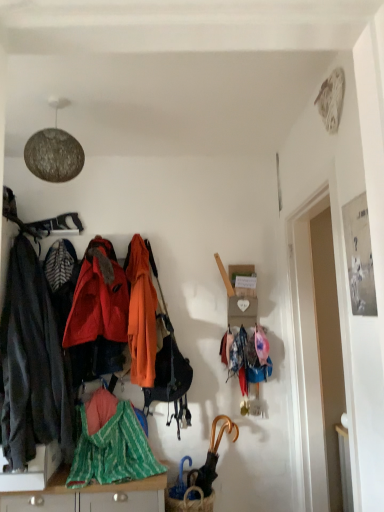
Question: Are dark gray fabric jacket at left, which is counted as the 1th jacket, starting from the left, and green striped fabric at lower center far apart?

Choices:
 (A) no
 (B) yes

Answer: (A)

Question: Is dark gray fabric jacket at left, the third jacket positioned from the right, not within green striped fabric at lower center?

Choices:
 (A) no
 (B) yes

Answer: (B)

Question: From a real-world perspective, is dark gray fabric jacket at left, which is counted as the 1th jacket, starting from the left, physically below green striped fabric at lower center?

Choices:
 (A) yes
 (B) no

Answer: (B)

Question: Can you confirm if dark gray fabric jacket at left, the third jacket positioned from the right, is smaller than green striped fabric at lower center?

Choices:
 (A) yes
 (B) no

Answer: (B)

Question: Does dark gray fabric jacket at left, the third jacket positioned from the right, have a greater width compared to green striped fabric at lower center?

Choices:
 (A) no
 (B) yes

Answer: (B)

Question: Is gold metallic umbrella at lower center to the left or to the right of green striped fabric at lower left in the image?

Choices:
 (A) right
 (B) left

Answer: (A)

Question: Looking at their shapes, would you say gold metallic umbrella at lower center is wider or thinner than green striped fabric at lower left?

Choices:
 (A) wide
 (B) thin

Answer: (B)

Question: In the image, is gold metallic umbrella at lower center positioned in front of or behind green striped fabric at lower left?

Choices:
 (A) behind
 (B) front

Answer: (A)

Question: From the image's perspective, is gold metallic umbrella at lower center located above or below green striped fabric at lower left?

Choices:
 (A) below
 (B) above

Answer: (A)

Question: In terms of width, does gold metallic umbrella at lower center look wider or thinner when compared to shiny red jacket at center, arranged as the 2th jacket when viewed from the left?

Choices:
 (A) thin
 (B) wide

Answer: (A)

Question: Visually, is gold metallic umbrella at lower center positioned to the left or to the right of shiny red jacket at center, arranged as the 2th jacket when viewed from the left?

Choices:
 (A) left
 (B) right

Answer: (B)

Question: Based on their sizes in the image, would you say gold metallic umbrella at lower center is bigger or smaller than shiny red jacket at center, which is the second jacket from right to left?

Choices:
 (A) small
 (B) big

Answer: (A)

Question: From a real-world perspective, is gold metallic umbrella at lower center physically located above or below shiny red jacket at center, arranged as the 2th jacket when viewed from the left?

Choices:
 (A) below
 (B) above

Answer: (A)

Question: Is green striped fabric at lower center in front of or behind orange matte handbag at center in the image?

Choices:
 (A) front
 (B) behind

Answer: (A)

Question: Is point pos(102,482) closer or farther from the camera than point pos(155,361)?

Choices:
 (A) closer
 (B) farther

Answer: (A)